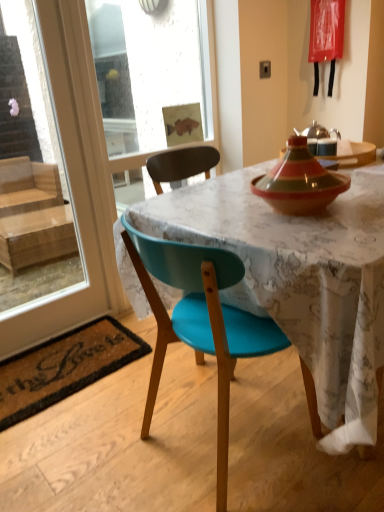
Where is `free point behind teal plastic chair at center`? free point behind teal plastic chair at center is located at coordinates (209, 371).